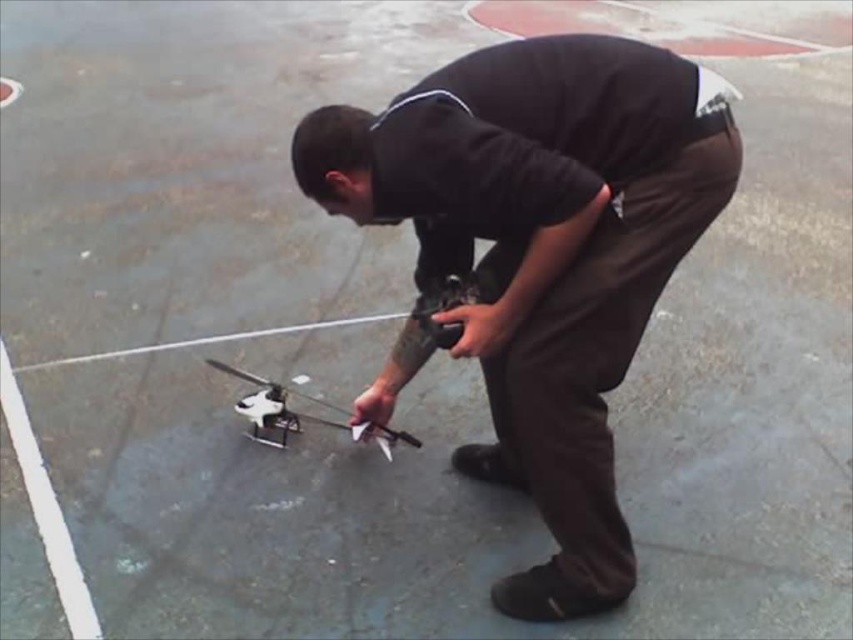
You are a photographer standing at the camera position. You want to take a closeup photo of the black matte remote control at center. Can you reach it without moving your feet?

The black matte remote control at center is 4.36 feet from camera, so yes, you can reach it without moving your feet since it is within arm reach.

You are a drone operator who wants to ensure the safety of your equipment. You notice both the black matte remote control at center and the white matte drone at center in the image. Which object is closer to you, and why?

The black matte remote control at center is closer to you because it is positioned in front of the white matte drone at center, indicating it is nearer in the visual plane.